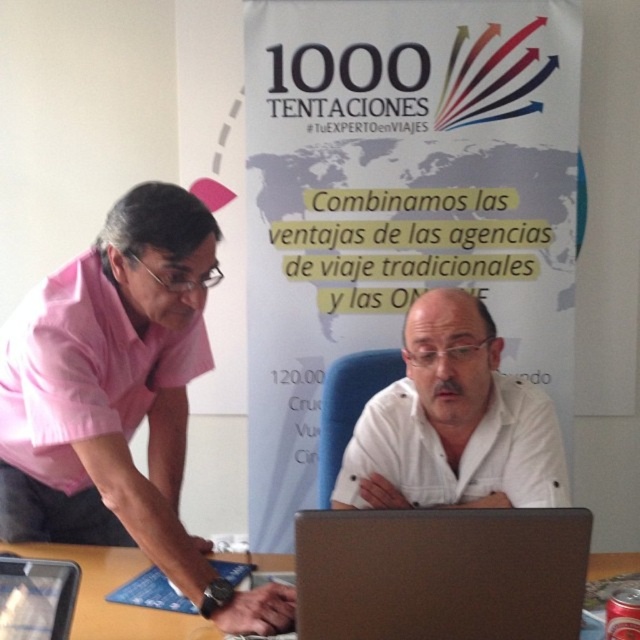
Is point (340, 528) less distant than point (424, 420)?

Yes.

Does brown matte laptop at center have a lesser height compared to white matte shirt at center?

Yes.

Between point (420, 531) and point (506, 451), which one is positioned in front?

Point (420, 531) is more forward.

At what (x,y) coordinates should I click in order to perform the action: click on brown matte laptop at center. Please return your answer as a coordinate pair (x, y). Looking at the image, I should click on (440, 573).

Who is taller, brown matte laptop at center or silver metallic laptop at center?

brown matte laptop at center is taller.

Who is positioned more to the right, brown matte laptop at center or silver metallic laptop at center?

brown matte laptop at center is more to the right.

In order to click on brown matte laptop at center in this screenshot , I will do `click(440, 573)`.

Between white paperboard at upper center and pink cotton shirt at left, which one appears on the left side from the viewer's perspective?

From the viewer's perspective, pink cotton shirt at left appears more on the left side.

The height and width of the screenshot is (640, 640). Find the location of `white paperboard at upper center`. white paperboard at upper center is located at coordinates (400, 202).

Is point (522, 292) closer to camera compared to point (147, 278)?

No, it is behind (147, 278).

Find the location of `white paperboard at upper center`. white paperboard at upper center is located at coordinates (400, 202).